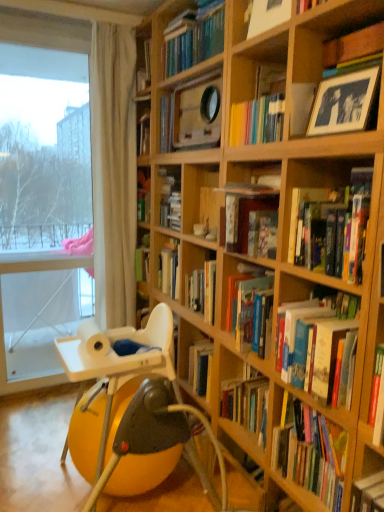
Question: From the image's perspective, does transparent glass window at left appear higher than hardcover books at center, arranged as the 1th book when ordered from the bottom?

Choices:
 (A) no
 (B) yes

Answer: (B)

Question: Considering the relative sizes of transparent glass window at left and hardcover books at center, the 6th book viewed from the top, in the image provided, is transparent glass window at left smaller than hardcover books at center, the 6th book viewed from the top,?

Choices:
 (A) yes
 (B) no

Answer: (B)

Question: Are transparent glass window at left and hardcover books at center, the 6th book viewed from the top, making contact?

Choices:
 (A) yes
 (B) no

Answer: (B)

Question: From a real-world perspective, is transparent glass window at left over hardcover books at center, the 6th book viewed from the top?

Choices:
 (A) no
 (B) yes

Answer: (B)

Question: Is transparent glass window at left facing towards hardcover books at center, arranged as the 1th book when ordered from the bottom?

Choices:
 (A) no
 (B) yes

Answer: (A)

Question: From the image's perspective, is transparent glass window at left beneath hardcover books at center, the 6th book viewed from the top?

Choices:
 (A) yes
 (B) no

Answer: (B)

Question: Considering the relative positions of transparent glass window at left and wooden frame at upper center, marked as the 5th book in a bottom-to-top arrangement, in the image provided, is transparent glass window at left to the right of wooden frame at upper center, marked as the 5th book in a bottom-to-top arrangement, from the viewer's perspective?

Choices:
 (A) yes
 (B) no

Answer: (B)

Question: Is transparent glass window at left to the left of wooden frame at upper center, marked as the 5th book in a bottom-to-top arrangement, from the viewer's perspective?

Choices:
 (A) yes
 (B) no

Answer: (A)

Question: Is the position of transparent glass window at left less distant than that of wooden frame at upper center, marked as the 5th book in a bottom-to-top arrangement?

Choices:
 (A) no
 (B) yes

Answer: (A)

Question: Is transparent glass window at left turned away from wooden frame at upper center, marked as the 5th book in a bottom-to-top arrangement?

Choices:
 (A) no
 (B) yes

Answer: (A)

Question: Is transparent glass window at left far away from wooden frame at upper center, marked as the 5th book in a bottom-to-top arrangement?

Choices:
 (A) yes
 (B) no

Answer: (A)

Question: Could you tell me if transparent glass window at left is turned towards wooden frame at upper center, the second book positioned from the top?

Choices:
 (A) no
 (B) yes

Answer: (A)

Question: Would you say hardcover book at center, arranged as the 5th book when viewed from the top, is outside hardcover book at center, the third book positioned from the bottom?

Choices:
 (A) yes
 (B) no

Answer: (A)